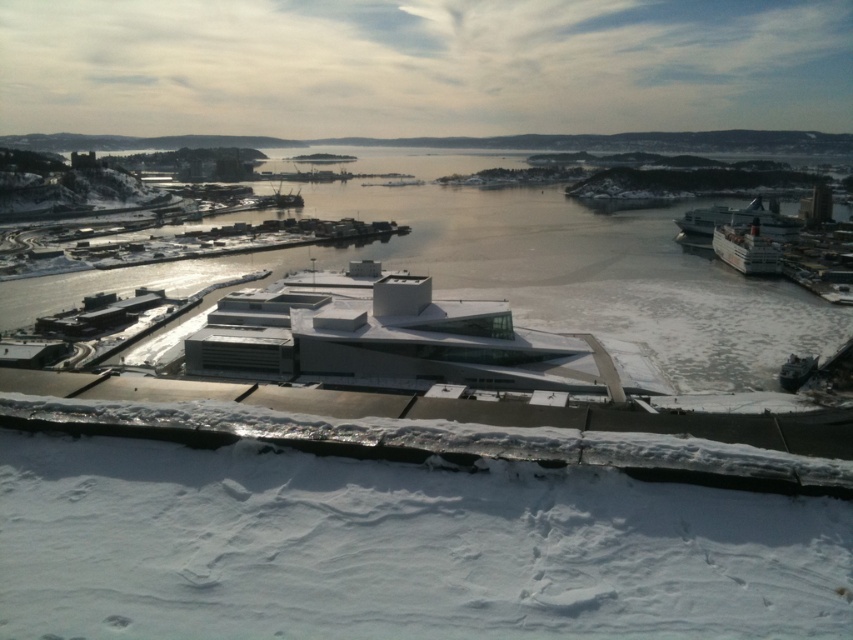
Question: Does white glossy cruise ship at right have a lesser width compared to metallic gray boat at lower right?

Choices:
 (A) yes
 (B) no

Answer: (B)

Question: Which of the following is the closest to the observer?

Choices:
 (A) (758, 268)
 (B) (699, 208)
 (C) (660, 342)

Answer: (C)

Question: Which object is positioned closest to the white glossy ship at right?

Choices:
 (A) white glossy cruise ship at right
 (B) clear water at center
 (C) metallic gray boat at lower right

Answer: (A)

Question: Is white glossy cruise ship at right positioned before metallic gray boat at lower right?

Choices:
 (A) no
 (B) yes

Answer: (A)

Question: Which point is closer to the camera?

Choices:
 (A) (784, 378)
 (B) (712, 221)

Answer: (A)

Question: Does white glossy ship at right appear over metallic gray boat at lower right?

Choices:
 (A) yes
 (B) no

Answer: (A)